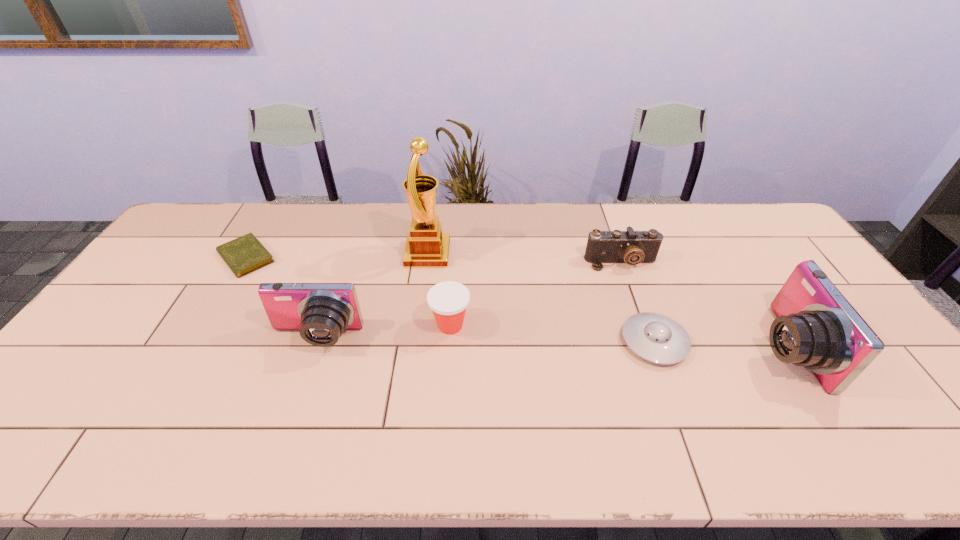
At what (x,y) coordinates should I click in order to perform the action: click on empty location between the leftmost object and the tallest camera. Please return your answer as a coordinate pair (x, y). Looking at the image, I should click on (515, 302).

Locate an element on the screen. free space between the farthest camera and the second shortest object is located at coordinates (637, 302).

Where is `vacant area that lies between the rightmost object and the second camera from left to right`? The image size is (960, 540). vacant area that lies between the rightmost object and the second camera from left to right is located at coordinates (702, 305).

Locate an element on the screen. The height and width of the screenshot is (540, 960). free space between the shortest camera and the award is located at coordinates (524, 258).

The image size is (960, 540). What are the coordinates of `free space between the shortest camera and the Dixie cup` in the screenshot? It's located at (536, 294).

Select which object is the sixth closest to the second shortest object. Please provide its 2D coordinates. Your answer should be formatted as a tuple, i.e. [(x, y)], where the tuple contains the x and y coordinates of a point satisfying the conditions above.

[(243, 255)]

Locate which object ranks fourth in proximity to the sixth object from right to left. Please provide its 2D coordinates. Your answer should be formatted as a tuple, i.e. [(x, y)], where the tuple contains the x and y coordinates of a point satisfying the conditions above.

[(632, 247)]

Locate an element on the screen. This screenshot has width=960, height=540. camera that stands as the second closest to the shortest object is located at coordinates (632, 247).

What are the coordinates of `the closest camera to the tallest object` in the screenshot? It's located at (321, 312).

Locate an element on the screen. free point that satisfies the following two spatial constraints: 1. on the front-facing side of the Dixie cup; 2. on the left side of the tallest object is located at coordinates (418, 325).